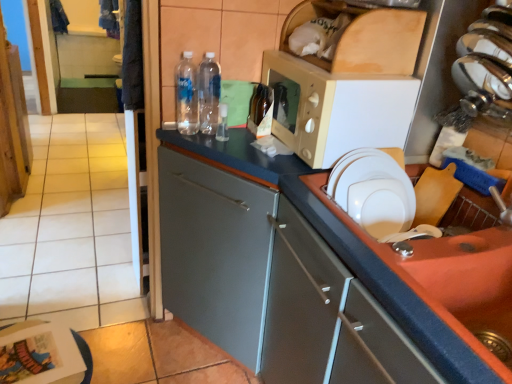
The height and width of the screenshot is (384, 512). What are the coordinates of `empty space that is to the right of clear plastic bottle at center, the first bottle in the left-to-right sequence` in the screenshot? It's located at (241, 140).